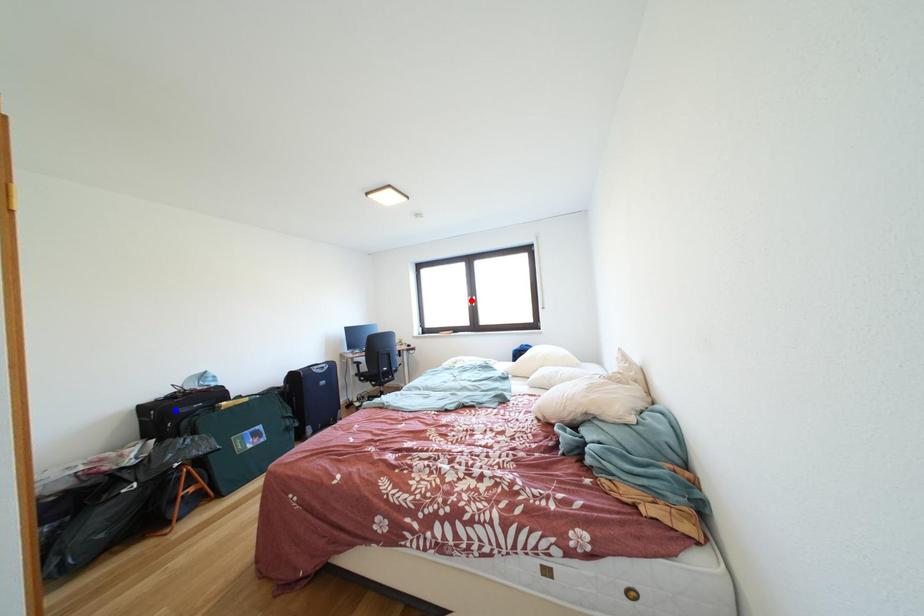
Question: Two points are marked on the image. Which point is closer to the camera?

Choices:
 (A) Blue point is closer.
 (B) Red point is closer.

Answer: (A)